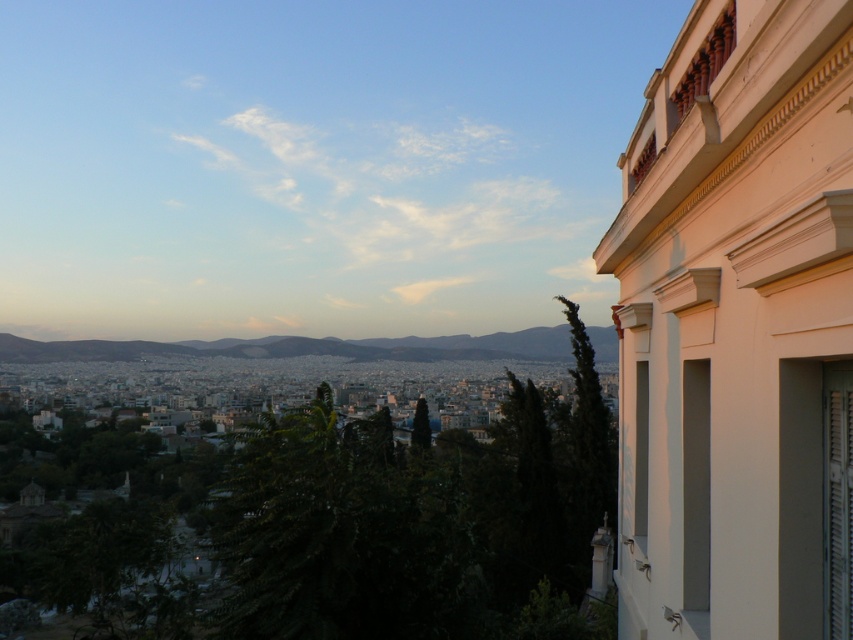
Question: Does white painted wood balcony at upper right appear under green grassy hill at center?

Choices:
 (A) no
 (B) yes

Answer: (A)

Question: Is white painted wood balcony at upper right wider than green grassy hill at center?

Choices:
 (A) yes
 (B) no

Answer: (B)

Question: Is white painted wood balcony at upper right below green grassy hill at center?

Choices:
 (A) no
 (B) yes

Answer: (A)